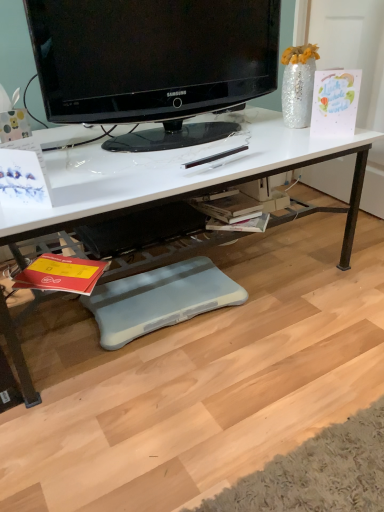
Question: Does black glossy television at upper center have a greater height compared to white glossy desk at center?

Choices:
 (A) yes
 (B) no

Answer: (B)

Question: Is black glossy television at upper center aimed at white glossy desk at center?

Choices:
 (A) yes
 (B) no

Answer: (B)

Question: Can you confirm if black glossy television at upper center is smaller than white glossy desk at center?

Choices:
 (A) yes
 (B) no

Answer: (A)

Question: Considering the relative sizes of black glossy television at upper center and white glossy desk at center in the image provided, is black glossy television at upper center bigger than white glossy desk at center?

Choices:
 (A) yes
 (B) no

Answer: (B)

Question: Is black glossy television at upper center positioned beyond the bounds of white glossy desk at center?

Choices:
 (A) yes
 (B) no

Answer: (A)

Question: Is black glossy television at upper center at the right side of white glossy desk at center?

Choices:
 (A) no
 (B) yes

Answer: (B)

Question: Considering the relative sizes of blue foam footrest at lower center and white glossy desk at center in the image provided, is blue foam footrest at lower center taller than white glossy desk at center?

Choices:
 (A) yes
 (B) no

Answer: (B)

Question: Considering the relative positions of blue foam footrest at lower center and white glossy desk at center in the image provided, is blue foam footrest at lower center to the right of white glossy desk at center from the viewer's perspective?

Choices:
 (A) yes
 (B) no

Answer: (A)

Question: Is blue foam footrest at lower center not close to white glossy desk at center?

Choices:
 (A) no
 (B) yes

Answer: (A)

Question: Can white glossy desk at center be found inside blue foam footrest at lower center?

Choices:
 (A) no
 (B) yes

Answer: (A)

Question: Is blue foam footrest at lower center positioned in front of white glossy desk at center?

Choices:
 (A) no
 (B) yes

Answer: (A)

Question: Considering the relative sizes of blue foam footrest at lower center and white glossy desk at center in the image provided, is blue foam footrest at lower center smaller than white glossy desk at center?

Choices:
 (A) yes
 (B) no

Answer: (A)

Question: Considering the relative sizes of blue foam footrest at lower center and black glossy television at upper center in the image provided, is blue foam footrest at lower center wider than black glossy television at upper center?

Choices:
 (A) yes
 (B) no

Answer: (A)